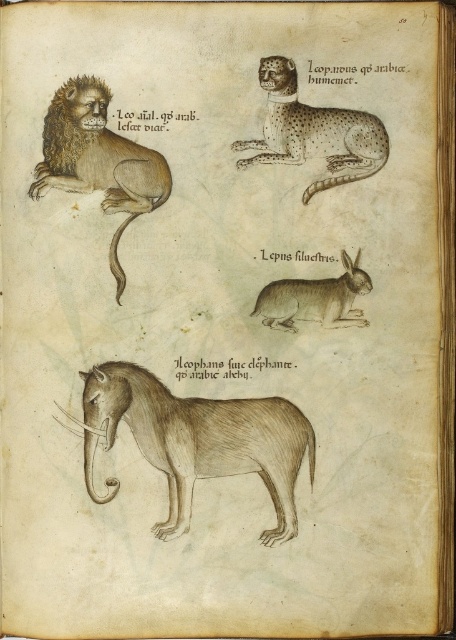
Is brown fur lion at left positioned before spotted fur cheetah at upper center?

Yes, it is.

Does brown fur lion at left have a lesser height compared to spotted fur cheetah at upper center?

No, brown fur lion at left is not shorter than spotted fur cheetah at upper center.

The image size is (456, 640). Describe the element at coordinates (98, 160) in the screenshot. I see `brown fur lion at left` at that location.

Where is `brown fur lion at left`? The image size is (456, 640). brown fur lion at left is located at coordinates (98, 160).

Can you confirm if spotted fur cheetah at upper center is positioned above brown textured rabbit at center?

Yes, spotted fur cheetah at upper center is above brown textured rabbit at center.

Who is positioned more to the left, spotted fur cheetah at upper center or brown textured rabbit at center?

spotted fur cheetah at upper center

Is point (336, 182) positioned after point (336, 323)?

Yes, point (336, 182) is farther from viewer.

What are the coordinates of `spotted fur cheetah at upper center` in the screenshot? It's located at (314, 131).

Can you confirm if brown textured elephant at center is positioned to the right of brown textured rabbit at center?

In fact, brown textured elephant at center is to the left of brown textured rabbit at center.

Can you confirm if brown textured elephant at center is taller than brown textured rabbit at center?

Indeed, brown textured elephant at center has a greater height compared to brown textured rabbit at center.

Is point (294, 464) farther from camera compared to point (274, 285)?

No, (294, 464) is closer to viewer.

Where is `brown textured elephant at center`? Image resolution: width=456 pixels, height=640 pixels. brown textured elephant at center is located at coordinates (196, 440).